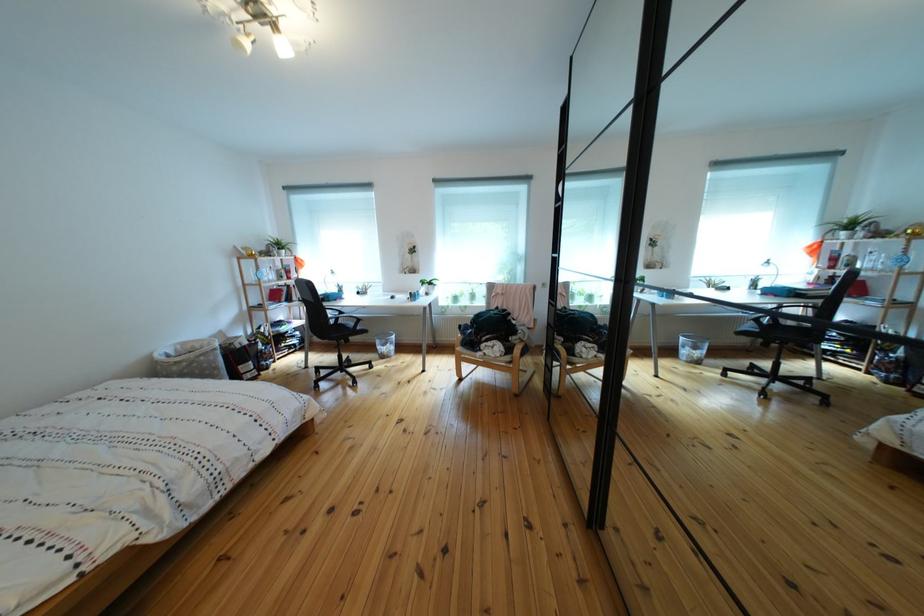
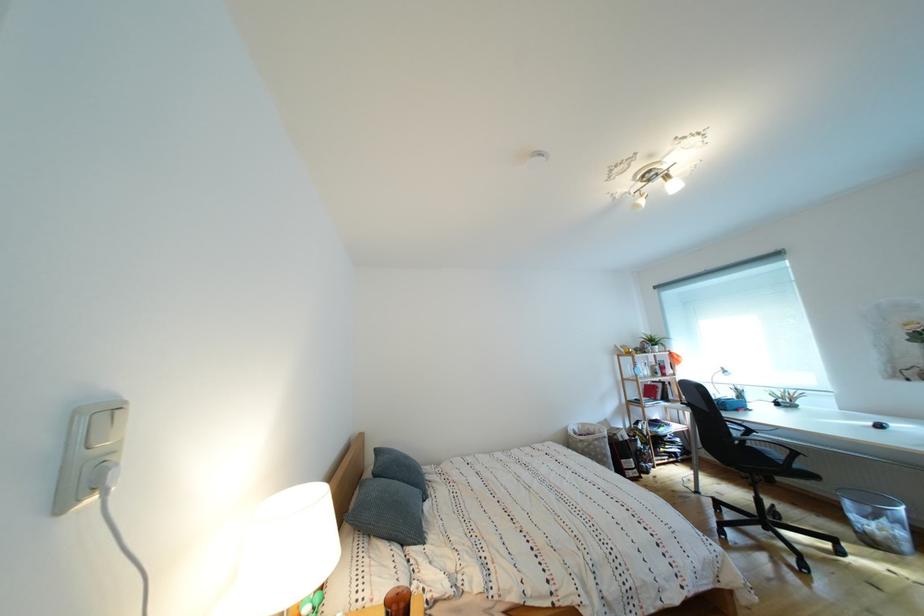
Locate, in the second image, the point that corresponds to the point at 195,350 in the first image.

(594, 430)